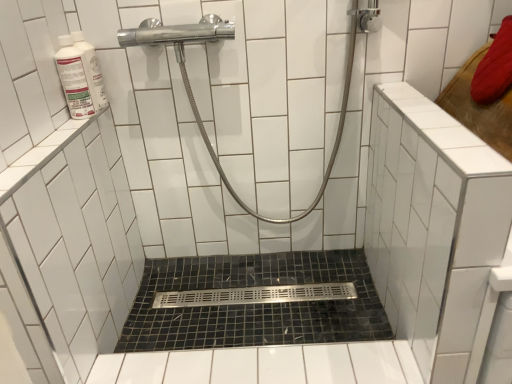
Question: Could you tell me if polished chrome showerhead at upper center is turned towards black mosaic tile bath at center?

Choices:
 (A) no
 (B) yes

Answer: (A)

Question: Is polished chrome showerhead at upper center turned away from black mosaic tile bath at center?

Choices:
 (A) yes
 (B) no

Answer: (B)

Question: Is polished chrome showerhead at upper center not inside black mosaic tile bath at center?

Choices:
 (A) no
 (B) yes

Answer: (B)

Question: Considering the relative positions of polished chrome showerhead at upper center and black mosaic tile bath at center in the image provided, is polished chrome showerhead at upper center in front of black mosaic tile bath at center?

Choices:
 (A) no
 (B) yes

Answer: (B)

Question: From a real-world perspective, is polished chrome showerhead at upper center positioned over black mosaic tile bath at center based on gravity?

Choices:
 (A) yes
 (B) no

Answer: (A)

Question: Is polished chrome showerhead at upper center far away from black mosaic tile bath at center?

Choices:
 (A) no
 (B) yes

Answer: (A)

Question: From a real-world perspective, is black mosaic tile bath at center on polished chrome showerhead at upper center?

Choices:
 (A) no
 (B) yes

Answer: (A)

Question: Can you confirm if black mosaic tile bath at center is positioned to the left of polished chrome showerhead at upper center?

Choices:
 (A) no
 (B) yes

Answer: (A)

Question: Would you say black mosaic tile bath at center contains polished chrome showerhead at upper center?

Choices:
 (A) yes
 (B) no

Answer: (B)

Question: From a real-world perspective, is black mosaic tile bath at center located beneath polished chrome showerhead at upper center?

Choices:
 (A) yes
 (B) no

Answer: (A)

Question: Is black mosaic tile bath at center next to polished chrome showerhead at upper center?

Choices:
 (A) yes
 (B) no

Answer: (B)

Question: Does black mosaic tile bath at center have a lesser width compared to polished chrome showerhead at upper center?

Choices:
 (A) yes
 (B) no

Answer: (B)

Question: From the image's perspective, is black mosaic tile bath at center above white glossy bottle at upper left?

Choices:
 (A) no
 (B) yes

Answer: (A)